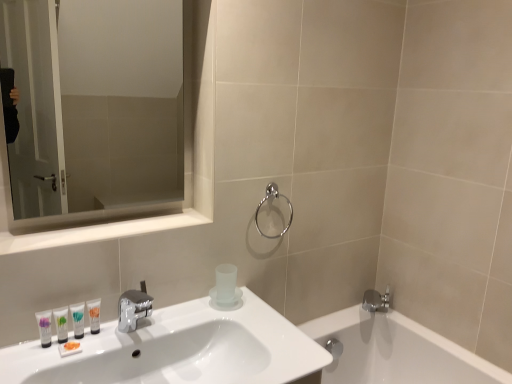
Question: Is white glossy tube at lower left, the third mouthwash when ordered from left to right, next to white glossy mirror at upper left and touching it?

Choices:
 (A) yes
 (B) no

Answer: (B)

Question: Can you confirm if white glossy tube at lower left, the third mouthwash when ordered from left to right, is bigger than white glossy mirror at upper left?

Choices:
 (A) no
 (B) yes

Answer: (A)

Question: Is white glossy tube at lower left, the third mouthwash when ordered from left to right, shorter than white glossy mirror at upper left?

Choices:
 (A) no
 (B) yes

Answer: (A)

Question: Does white glossy tube at lower left, placed as the 2th mouthwash when sorted from right to left, have a smaller size compared to white glossy mirror at upper left?

Choices:
 (A) yes
 (B) no

Answer: (A)

Question: Does white glossy tube at lower left, placed as the 2th mouthwash when sorted from right to left, have a lesser width compared to white glossy mirror at upper left?

Choices:
 (A) yes
 (B) no

Answer: (A)

Question: Is white glossy tube at lower left, the third mouthwash when ordered from left to right, positioned behind white glossy mirror at upper left?

Choices:
 (A) no
 (B) yes

Answer: (B)

Question: Can you confirm if white glossy sink at lower left is wider than matte white tube at lower left, marked as the fourth mouthwash in a right-to-left arrangement?

Choices:
 (A) no
 (B) yes

Answer: (B)

Question: Is white glossy sink at lower left at the left side of matte white tube at lower left, marked as the fourth mouthwash in a right-to-left arrangement?

Choices:
 (A) yes
 (B) no

Answer: (B)

Question: From a real-world perspective, is white glossy sink at lower left over matte white tube at lower left, placed as the 1th mouthwash when sorted from left to right?

Choices:
 (A) yes
 (B) no

Answer: (B)

Question: Is white glossy sink at lower left bigger than matte white tube at lower left, marked as the fourth mouthwash in a right-to-left arrangement?

Choices:
 (A) yes
 (B) no

Answer: (A)

Question: Would you say white glossy sink at lower left is a long distance from matte white tube at lower left, marked as the fourth mouthwash in a right-to-left arrangement?

Choices:
 (A) no
 (B) yes

Answer: (A)

Question: Is white glossy sink at lower left taller than matte white tube at lower left, placed as the 1th mouthwash when sorted from left to right?

Choices:
 (A) yes
 (B) no

Answer: (A)

Question: From a real-world perspective, is white glossy tube at lower left, which ranks as the second mouthwash in left-to-right order, on top of clear glass mirror at upper left?

Choices:
 (A) yes
 (B) no

Answer: (B)